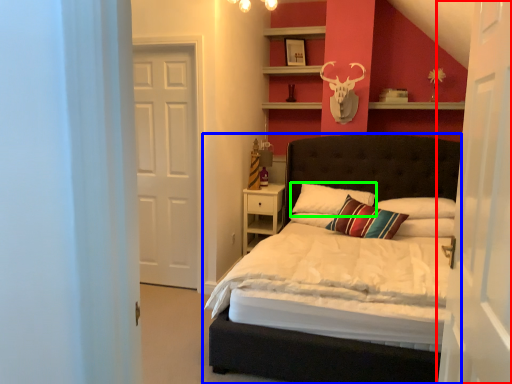
Question: Based on their relative distances, which object is nearer to door (highlighted by a red box)? Choose from bed (highlighted by a blue box) and pillow (highlighted by a green box).

Choices:
 (A) bed
 (B) pillow

Answer: (B)